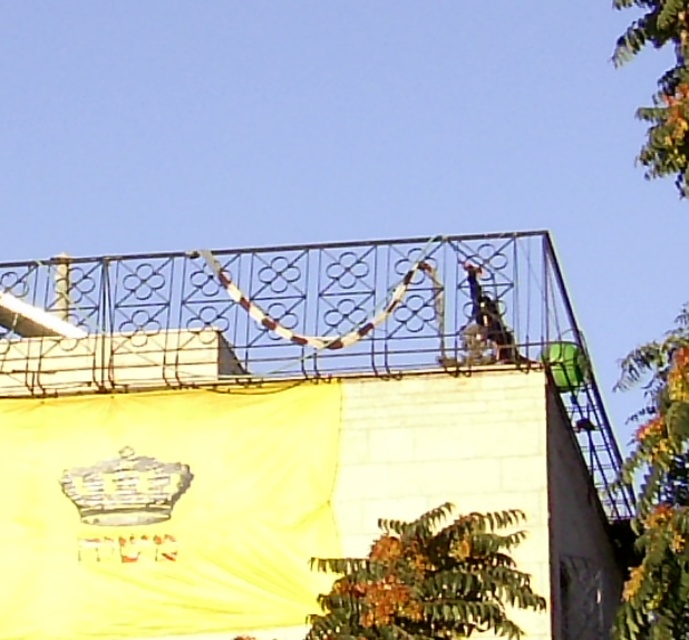
You are a safety inspector checking the construction site. You notice the metallic railing at upper center and the metallic helmet at upper right. Which object is positioned to the left of the other?

The metallic railing at upper center is positioned to the left of the metallic helmet at upper right.

You are a safety inspector reviewing the construction site. You notice the metallic railing at upper center and the metallic helmet at upper right. Which object is closer to the inspector from the inspector perspective?

The metallic railing at upper center is closer to the inspector because it is in front of the metallic helmet at upper right.

You are a safety inspector assessing the construction site. You notice the metallic railing at upper center and the metallic helmet at upper right. Based on standard safety protocols, which object should you prioritize inspecting for potential hazards?

The metallic railing at upper center should be prioritized for inspection because railings are critical for fall protection, and if it is wider than the metallic helmet at upper right, it might have structural issues that could pose a greater risk to workers.